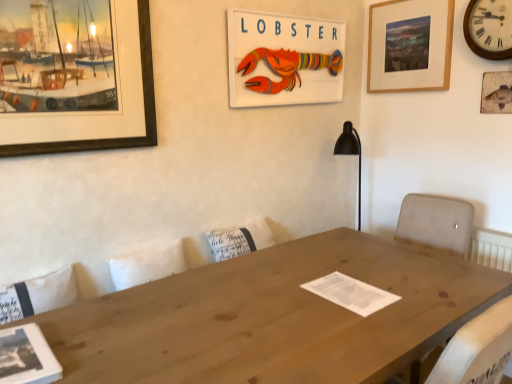
You are a GUI agent. You are given a task and a screenshot of the screen. Output one action in this format:
    pyautogui.click(x=<x>, y=<y>)
    Task: Click on the free spot above wooden lobster sign at upper center, acting as the 2th picture frame starting from the left (from a real-world perspective)
    
    Given the screenshot: What is the action you would take?
    pyautogui.click(x=288, y=9)